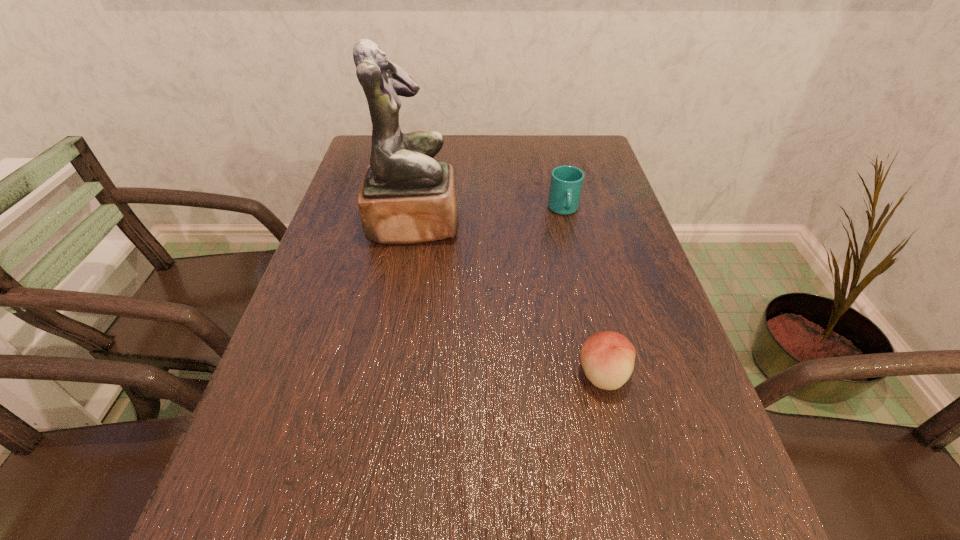
What are the coordinates of `vacant point located between the cup and the sculpture` in the screenshot? It's located at (489, 217).

This screenshot has height=540, width=960. I want to click on object that stands as the second closest to the peach, so click(566, 183).

Select which object is the closest to the cup. Please provide its 2D coordinates. Your answer should be formatted as a tuple, i.e. [(x, y)], where the tuple contains the x and y coordinates of a point satisfying the conditions above.

[(407, 197)]

Where is `vacant region that satisfies the following two spatial constraints: 1. in a relaxed pose on the peach; 2. on the left side of the sculpture`? The height and width of the screenshot is (540, 960). vacant region that satisfies the following two spatial constraints: 1. in a relaxed pose on the peach; 2. on the left side of the sculpture is located at coordinates 388,374.

Find the location of a particular element. vacant space that satisfies the following two spatial constraints: 1. in a relaxed pose on the sculpture; 2. on the back side of the peach is located at coordinates (388, 374).